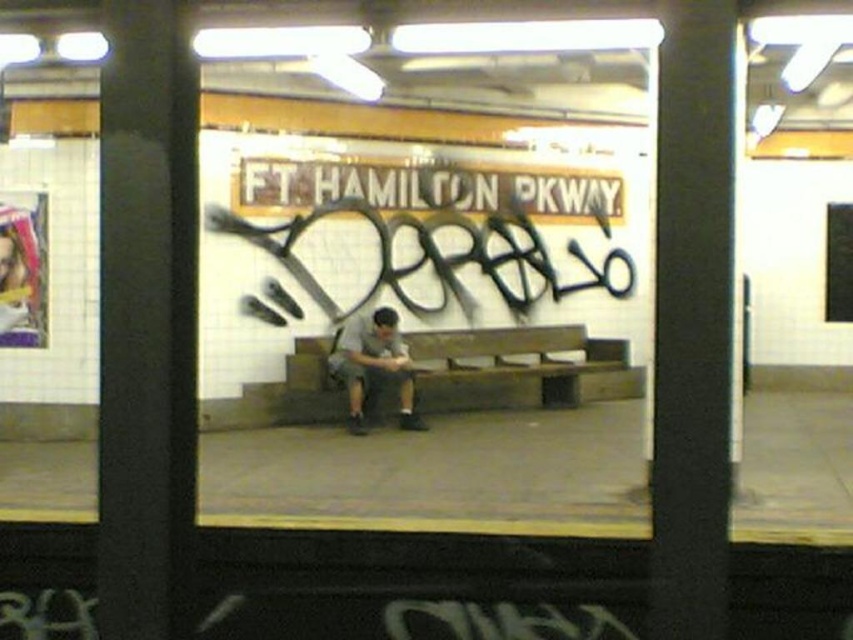
Question: Which of the following is the farthest from the observer?

Choices:
 (A) gray fabric shirt at center
 (B) wooden bench at center

Answer: (B)

Question: Does wooden bench at center appear over gray fabric shirt at center?

Choices:
 (A) yes
 (B) no

Answer: (A)

Question: Can you confirm if wooden bench at center is positioned to the right of gray fabric shirt at center?

Choices:
 (A) yes
 (B) no

Answer: (A)

Question: Can you confirm if wooden bench at center is positioned to the right of gray fabric shirt at center?

Choices:
 (A) no
 (B) yes

Answer: (B)